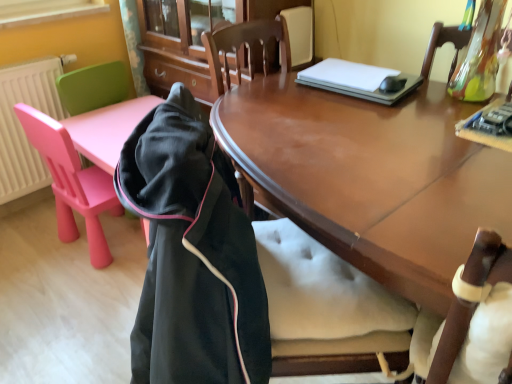
Question: Considering the relative sizes of shiny brown wood desk at center and pink plastic chair at left, the 2th chair when ordered from back to front, in the image provided, is shiny brown wood desk at center smaller than pink plastic chair at left, the 2th chair when ordered from back to front,?

Choices:
 (A) no
 (B) yes

Answer: (A)

Question: Could you tell me if shiny brown wood desk at center is turned towards pink plastic chair at left, placed as the 1th chair when sorted from front to back?

Choices:
 (A) no
 (B) yes

Answer: (A)

Question: Is shiny brown wood desk at center to the right of pink plastic chair at left, placed as the 1th chair when sorted from front to back, from the viewer's perspective?

Choices:
 (A) no
 (B) yes

Answer: (B)

Question: From the image's perspective, is shiny brown wood desk at center beneath pink plastic chair at left, the 2th chair when ordered from back to front?

Choices:
 (A) yes
 (B) no

Answer: (A)

Question: Is shiny brown wood desk at center not inside pink plastic chair at left, placed as the 1th chair when sorted from front to back?

Choices:
 (A) no
 (B) yes

Answer: (B)

Question: From a real-world perspective, is shiny brown wood desk at center beneath pink plastic chair at left, placed as the 1th chair when sorted from front to back?

Choices:
 (A) no
 (B) yes

Answer: (A)

Question: Would you say shiny brown wood desk at center is a long distance from white plastic radiator at left?

Choices:
 (A) yes
 (B) no

Answer: (A)

Question: Is white plastic radiator at left inside shiny brown wood desk at center?

Choices:
 (A) yes
 (B) no

Answer: (B)

Question: Can you confirm if shiny brown wood desk at center is shorter than white plastic radiator at left?

Choices:
 (A) yes
 (B) no

Answer: (B)

Question: Is shiny brown wood desk at center oriented towards white plastic radiator at left?

Choices:
 (A) yes
 (B) no

Answer: (B)

Question: Can you confirm if shiny brown wood desk at center is smaller than white plastic radiator at left?

Choices:
 (A) no
 (B) yes

Answer: (A)

Question: From the image's perspective, is shiny brown wood desk at center beneath white plastic radiator at left?

Choices:
 (A) yes
 (B) no

Answer: (A)

Question: Is black fleece jacket at left oriented towards white plastic radiator at left?

Choices:
 (A) no
 (B) yes

Answer: (A)